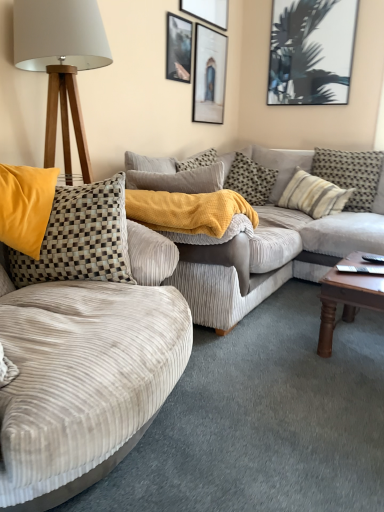
What are the coordinates of `checkered fabric pillow at center, which ranks as the 3th pillow in left-to-right order` in the screenshot? It's located at (282, 165).

What do you see at coordinates (87, 374) in the screenshot? The image size is (384, 512). I see `velvet beige couch at left, which is counted as the second studio couch, starting from the back` at bounding box center [87, 374].

The height and width of the screenshot is (512, 384). In order to click on velvet beige couch at left, which is counted as the second studio couch, starting from the back in this screenshot , I will do (87, 374).

Find the location of a particular element. matte black picture frame at upper right, the 1th picture frame when ordered from right to left is located at coordinates (311, 52).

Describe the element at coordinates (311, 52) in the screenshot. I see `matte black picture frame at upper right, the 1th picture frame when ordered from right to left` at that location.

This screenshot has height=512, width=384. In order to click on striped fabric pillow at right, marked as the first pillow in a right-to-left arrangement in this screenshot , I will do `click(350, 174)`.

Identify the location of metallic silver picture frame at upper center, placed as the 1th picture frame when sorted from left to right. The width and height of the screenshot is (384, 512). [x=178, y=48].

At what (x,y) coordinates should I click in order to perform the action: click on velvet beige couch at center, the second studio couch when ordered from front to back. Please return your answer as a coordinate pair (x, y). This screenshot has width=384, height=512. Looking at the image, I should click on coord(271,249).

Locate an element on the screen. The image size is (384, 512). matte glass picture frame at upper center, which is the 2th picture frame from right to left is located at coordinates (209, 75).

Is point (248, 201) closer to viewer compared to point (352, 203)?

No, it is not.

Is checkered fabric pillow at center, the 4th pillow when ordered from right to left, bigger or smaller than striped fabric pillow at right, the 5th pillow from the left?

checkered fabric pillow at center, the 4th pillow when ordered from right to left, is smaller than striped fabric pillow at right, the 5th pillow from the left.

Is striped fabric pillow at right, the 5th pillow from the left, surrounded by checkered fabric pillow at center, which is counted as the second pillow, starting from the left?

No, striped fabric pillow at right, the 5th pillow from the left, is located outside of checkered fabric pillow at center, which is counted as the second pillow, starting from the left.

From the picture: From the image's perspective, between velvet beige couch at center, the 1th studio couch from the back, and striped fabric pillow at center, which ranks as the 2th pillow in right-to-left order, who is located below?

velvet beige couch at center, the 1th studio couch from the back.

Which is more to the left, velvet beige couch at center, the second studio couch when ordered from front to back, or striped fabric pillow at center, which ranks as the 2th pillow in right-to-left order?

velvet beige couch at center, the second studio couch when ordered from front to back, is more to the left.

Is velvet beige couch at center, the 1th studio couch from the back, positioned beyond the bounds of striped fabric pillow at center, placed as the 4th pillow when sorted from left to right?

velvet beige couch at center, the 1th studio couch from the back, is positioned outside striped fabric pillow at center, placed as the 4th pillow when sorted from left to right.

Considering the relative sizes of velvet beige couch at center, the 1th studio couch from the back, and striped fabric pillow at center, placed as the 4th pillow when sorted from left to right, in the image provided, is velvet beige couch at center, the 1th studio couch from the back, taller than striped fabric pillow at center, placed as the 4th pillow when sorted from left to right,?

Indeed, velvet beige couch at center, the 1th studio couch from the back, has a greater height compared to striped fabric pillow at center, placed as the 4th pillow when sorted from left to right.

From the image's perspective, who appears lower, matte glass picture frame at upper center, the third picture frame positioned from the left, or matte black picture frame at upper center, acting as the second picture frame starting from the left?

matte glass picture frame at upper center, the third picture frame positioned from the left.

Are matte glass picture frame at upper center, which is the 2th picture frame from right to left, and matte black picture frame at upper center, positioned as the 3th picture frame in right-to-left order, located far from each other?

Actually, matte glass picture frame at upper center, which is the 2th picture frame from right to left, and matte black picture frame at upper center, positioned as the 3th picture frame in right-to-left order, are a little close together.

Between matte glass picture frame at upper center, the third picture frame positioned from the left, and matte black picture frame at upper center, acting as the second picture frame starting from the left, which one has smaller size?

Smaller between the two is matte black picture frame at upper center, acting as the second picture frame starting from the left.

Can you tell me how much matte glass picture frame at upper center, which is the 2th picture frame from right to left, and matte black picture frame at upper center, acting as the second picture frame starting from the left, differ in facing direction?

The facing directions of matte glass picture frame at upper center, which is the 2th picture frame from right to left, and matte black picture frame at upper center, acting as the second picture frame starting from the left, are 0.624 degrees apart.

Would you say velvet beige couch at left, which is counted as the second studio couch, starting from the back, is inside or outside metallic silver picture frame at upper center, the fourth picture frame viewed from the right?

velvet beige couch at left, which is counted as the second studio couch, starting from the back, is not enclosed by metallic silver picture frame at upper center, the fourth picture frame viewed from the right.

Is velvet beige couch at left, which is counted as the second studio couch, starting from the back, oriented away from metallic silver picture frame at upper center, placed as the 1th picture frame when sorted from left to right?

No.

Consider the image. In the image, is velvet beige couch at left, arranged as the first studio couch when viewed from the front, positioned in front of or behind metallic silver picture frame at upper center, placed as the 1th picture frame when sorted from left to right?

velvet beige couch at left, arranged as the first studio couch when viewed from the front, is in front of metallic silver picture frame at upper center, placed as the 1th picture frame when sorted from left to right.

Are velvet beige couch at left, which is counted as the second studio couch, starting from the back, and metallic silver picture frame at upper center, the fourth picture frame viewed from the right, located far from each other?

Yes.

Is wooden tripod lamp at left wider than matte black picture frame at upper right, the fourth picture frame from the left?

Yes, wooden tripod lamp at left is wider than matte black picture frame at upper right, the fourth picture frame from the left.

Considering the positions of point (33, 17) and point (303, 51), is point (33, 17) closer or farther from the camera than point (303, 51)?

Point (33, 17) is closer to the camera than point (303, 51).

From a real-world perspective, is wooden tripod lamp at left physically located above or below matte black picture frame at upper right, the fourth picture frame from the left?

In terms of real-world spatial position, wooden tripod lamp at left is below matte black picture frame at upper right, the fourth picture frame from the left.

Is matte black picture frame at upper right, the fourth picture frame from the left, completely or partially inside wooden tripod lamp at left?

No, matte black picture frame at upper right, the fourth picture frame from the left, is not surrounded by wooden tripod lamp at left.

Find the location of a particular element. lamp that is below the metallic silver picture frame at upper center, placed as the 1th picture frame when sorted from left to right (from the image's perspective) is located at coordinates (61, 64).

Considering the sizes of objects metallic silver picture frame at upper center, placed as the 1th picture frame when sorted from left to right, and wooden tripod lamp at left in the image provided, who is smaller, metallic silver picture frame at upper center, placed as the 1th picture frame when sorted from left to right, or wooden tripod lamp at left?

metallic silver picture frame at upper center, placed as the 1th picture frame when sorted from left to right, is smaller.

Is wooden tripod lamp at left at the back of metallic silver picture frame at upper center, the fourth picture frame viewed from the right?

That's not correct — metallic silver picture frame at upper center, the fourth picture frame viewed from the right, is not looking away from wooden tripod lamp at left.

Which of these two, metallic silver picture frame at upper center, the fourth picture frame viewed from the right, or wooden tripod lamp at left, is thinner?

With smaller width is metallic silver picture frame at upper center, the fourth picture frame viewed from the right.

Can you see matte black picture frame at upper center, positioned as the 3th picture frame in right-to-left order, touching matte glass picture frame at upper center, the third picture frame positioned from the left?

They are not placed beside each other.

Is point (213, 21) farther from camera compared to point (195, 121)?

No, (213, 21) is closer to viewer.

Based on their sizes in the image, would you say matte black picture frame at upper center, acting as the second picture frame starting from the left, is bigger or smaller than matte glass picture frame at upper center, which is the 2th picture frame from right to left?

matte black picture frame at upper center, acting as the second picture frame starting from the left, is smaller than matte glass picture frame at upper center, which is the 2th picture frame from right to left.

Considering their positions, is matte black picture frame at upper center, positioned as the 3th picture frame in right-to-left order, located in front of or behind matte glass picture frame at upper center, which is the 2th picture frame from right to left?

Visually, matte black picture frame at upper center, positioned as the 3th picture frame in right-to-left order, is located in front of matte glass picture frame at upper center, which is the 2th picture frame from right to left.

The width and height of the screenshot is (384, 512). Identify the location of pillow that is the 2nd one above the checkered fabric pillow at center, the 4th pillow when ordered from right to left (from a real-world perspective). (350, 174).

From the image's perspective, count 1st studio couchs downward from the striped fabric pillow at center, which ranks as the 2th pillow in right-to-left order, and point to it. Please provide its 2D coordinates.

[(271, 249)]

Considering their positions, is velvet beige couch at center, the 1th studio couch from the back, positioned closer to striped fabric pillow at center, placed as the 4th pillow when sorted from left to right, than checkered fabric pillow at center, positioned as the fifth pillow in right-to-left order?

Based on the image, velvet beige couch at center, the 1th studio couch from the back, appears to be nearer to striped fabric pillow at center, placed as the 4th pillow when sorted from left to right.

Considering their positions, is metallic silver picture frame at upper center, placed as the 1th picture frame when sorted from left to right, positioned further to velvet beige couch at center, the 1th studio couch from the back, than wooden tripod lamp at left?

metallic silver picture frame at upper center, placed as the 1th picture frame when sorted from left to right.

Estimate the real-world distances between objects in this image. Which object is closer to checkered fabric pillow at center, which appears as the 3th pillow when viewed from the right, striped fabric pillow at right, marked as the first pillow in a right-to-left arrangement, or striped fabric pillow at center, placed as the 4th pillow when sorted from left to right?

striped fabric pillow at center, placed as the 4th pillow when sorted from left to right, is closer to checkered fabric pillow at center, which appears as the 3th pillow when viewed from the right.

Estimate the real-world distances between objects in this image. Which object is further from velvet beige couch at center, the second studio couch when ordered from front to back, checkered fabric pillow at center, which ranks as the 3th pillow in left-to-right order, or striped fabric pillow at right, the 5th pillow from the left?

The object further to velvet beige couch at center, the second studio couch when ordered from front to back, is checkered fabric pillow at center, which ranks as the 3th pillow in left-to-right order.

In the scene shown: Which object lies nearer to the anchor point checkered fabric pillow at center, the 4th pillow when ordered from right to left, checkered fabric pillow at center, arranged as the first pillow when viewed from the left, or striped fabric pillow at right, marked as the first pillow in a right-to-left arrangement?

Among the two, striped fabric pillow at right, marked as the first pillow in a right-to-left arrangement, is located nearer to checkered fabric pillow at center, the 4th pillow when ordered from right to left.

From the picture: Based on their spatial positions, is striped fabric pillow at center, placed as the 4th pillow when sorted from left to right, or matte black picture frame at upper center, acting as the second picture frame starting from the left, further from matte glass picture frame at upper center, which is the 2th picture frame from right to left?

The object further to matte glass picture frame at upper center, which is the 2th picture frame from right to left, is striped fabric pillow at center, placed as the 4th pillow when sorted from left to right.

Based on their spatial positions, is striped fabric pillow at right, the 5th pillow from the left, or matte glass picture frame at upper center, which is the 2th picture frame from right to left, further from checkered fabric pillow at center, which ranks as the 3th pillow in left-to-right order?

The object further to checkered fabric pillow at center, which ranks as the 3th pillow in left-to-right order, is matte glass picture frame at upper center, which is the 2th picture frame from right to left.

Estimate the real-world distances between objects in this image. Which object is closer to matte black picture frame at upper center, acting as the second picture frame starting from the left, checkered fabric pillow at center, positioned as the fifth pillow in right-to-left order, or metallic silver picture frame at upper center, placed as the 1th picture frame when sorted from left to right?

Based on the image, metallic silver picture frame at upper center, placed as the 1th picture frame when sorted from left to right, appears to be nearer to matte black picture frame at upper center, acting as the second picture frame starting from the left.

Where is `lamp located between velvet beige couch at center, the second studio couch when ordered from front to back, and checkered fabric pillow at center, which appears as the 3th pillow when viewed from the right, in the depth direction`? Image resolution: width=384 pixels, height=512 pixels. lamp located between velvet beige couch at center, the second studio couch when ordered from front to back, and checkered fabric pillow at center, which appears as the 3th pillow when viewed from the right, in the depth direction is located at coordinates (61, 64).

Find the location of a particular element. Image resolution: width=384 pixels, height=512 pixels. pillow between metallic silver picture frame at upper center, placed as the 1th picture frame when sorted from left to right, and checkered fabric pillow at center, arranged as the first pillow when viewed from the left, in the up-down direction is located at coordinates (282, 165).

In order to click on studio couch between velvet beige couch at left, arranged as the first studio couch when viewed from the front, and striped fabric pillow at right, marked as the first pillow in a right-to-left arrangement, in the front-back direction in this screenshot , I will do `click(271, 249)`.

Locate an element on the screen. The width and height of the screenshot is (384, 512). pillow between matte glass picture frame at upper center, the third picture frame positioned from the left, and checkered fabric pillow at center, arranged as the first pillow when viewed from the left, vertically is located at coordinates (282, 165).